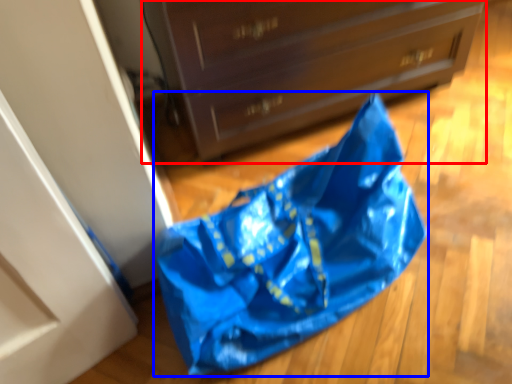
Question: Which object appears farthest to the camera in this image, chest of drawers (highlighted by a red box) or grocery bag (highlighted by a blue box)?

Choices:
 (A) chest of drawers
 (B) grocery bag

Answer: (A)